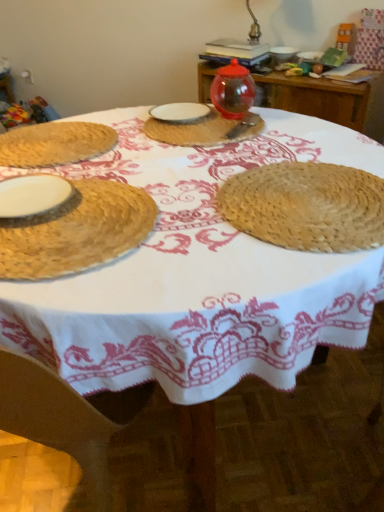
You are a GUI agent. You are given a task and a screenshot of the screen. Output one action in this format:
    pyautogui.click(x=<x>, y=<y>)
    Task: Click on the vacant point to the left of white ceramic plate at center, the 2th tableware viewed from the back
    This screenshot has height=512, width=384.
    Given the screenshot: What is the action you would take?
    pyautogui.click(x=125, y=121)